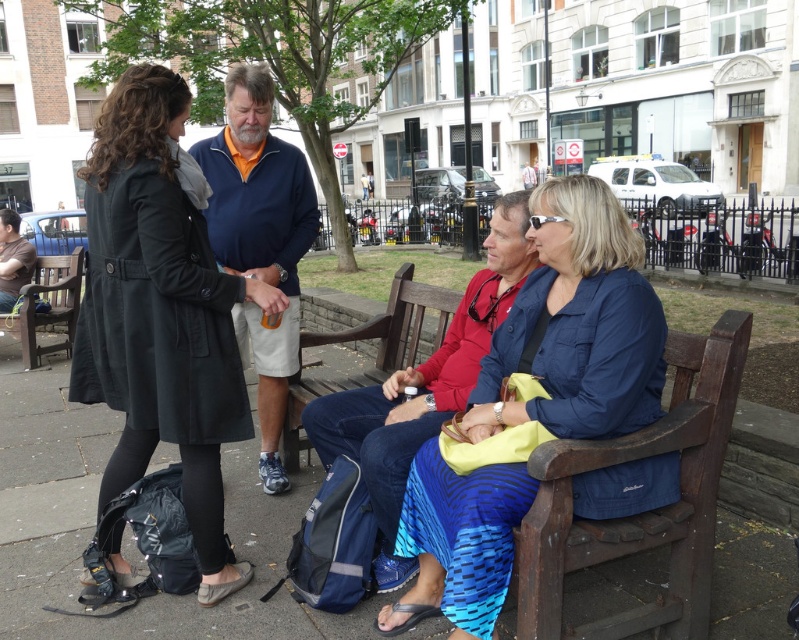
Question: Does brown wooden bench at center have a larger size compared to dark brown wooden bench at left?

Choices:
 (A) no
 (B) yes

Answer: (A)

Question: Is blue fleece at center positioned before brown wooden bench at center?

Choices:
 (A) no
 (B) yes

Answer: (B)

Question: Considering the real-world distances, which object is farthest from the brown wooden bench at center?

Choices:
 (A) blue fleece at center
 (B) dark brown wooden bench at left

Answer: (B)

Question: Which point is closer to the camera?

Choices:
 (A) (364, 381)
 (B) (261, 136)

Answer: (B)

Question: Can you confirm if blue woven skirt at center is positioned to the right of dark brown wooden bench at left?

Choices:
 (A) no
 (B) yes

Answer: (B)

Question: Among these objects, which one is nearest to the camera?

Choices:
 (A) black matte coat at left
 (B) brown wooden bench at center
 (C) blue woven skirt at center
 (D) dark brown wooden bench at left

Answer: (C)